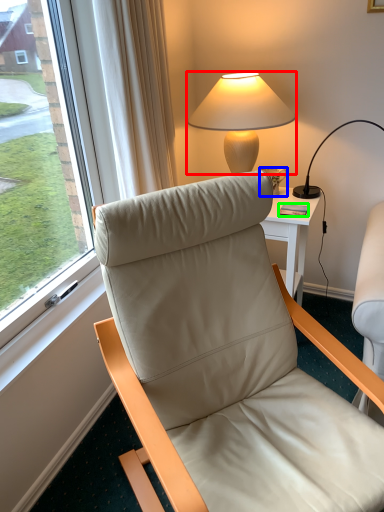
Question: Which is nearer to the lamp (highlighted by a red box)? coffee cup (highlighted by a blue box) or mobile phone (highlighted by a green box).

Choices:
 (A) coffee cup
 (B) mobile phone

Answer: (A)